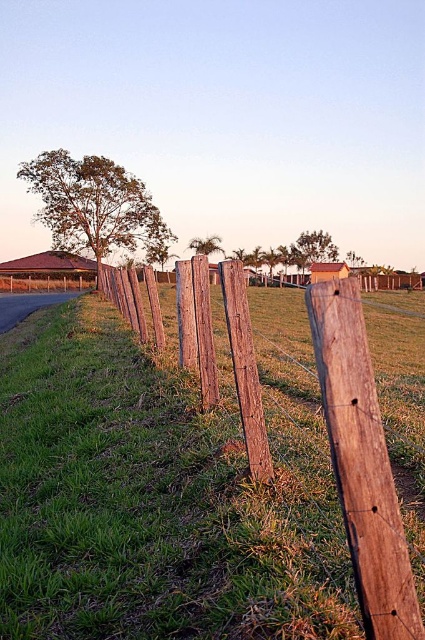
Question: Which of the following is the farthest from the observer?

Choices:
 (A) (413, 582)
 (B) (246, 403)

Answer: (B)

Question: Which is farther from the weathered wood post at center?

Choices:
 (A) weathered wood fence at center
 (B) brown wooden post at center

Answer: (A)

Question: Can you confirm if weathered wood fence at center is positioned to the left of weathered wood post at center?

Choices:
 (A) yes
 (B) no

Answer: (A)

Question: Which of the following is the farthest from the observer?

Choices:
 (A) (249, 376)
 (B) (337, 324)
 (C) (368, 472)

Answer: (A)

Question: Is weathered wood fence at center smaller than weathered wood post at center?

Choices:
 (A) yes
 (B) no

Answer: (B)

Question: Is weathered wood fence at center to the left of weathered wood post at center from the viewer's perspective?

Choices:
 (A) yes
 (B) no

Answer: (A)